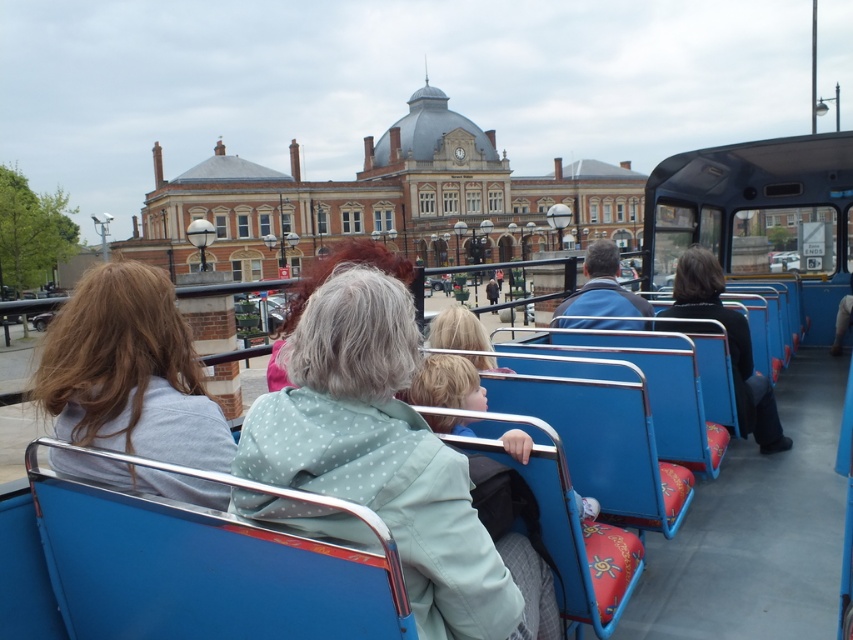
You are a tour guide on the bus and need to hand out maps to the passengers. You see the light gray fabric jacket at center and the black fabric jacket at right. Which jacket should you hand the map to based on their height?

The light gray fabric jacket at center is taller than the black fabric jacket at right, so you should hand the map to the passenger wearing the light gray fabric jacket at center.

You are a passenger on the tour bus and want to take a photo of the blue fabric coach at center without the light green polka dot jacket at center blocking the view. Is the jacket currently blocking your direct line of sight to the coach?

The light green polka dot jacket at center is in front of the blue fabric coach at center, so yes, the jacket is blocking the direct line of sight to the coach.

Looking at this image, you are a tour guide on the bus and need to hand out maps to two passengers. You see the light gray fabric jacket at center and the black fabric jacket at right. Which passenger should you approach first if you want to give the map to the person sitting closer to the front of the bus?

The black fabric jacket at right is closer to the front of the bus than the light gray fabric jacket at center, so you should approach the passenger wearing the black fabric jacket at right first.